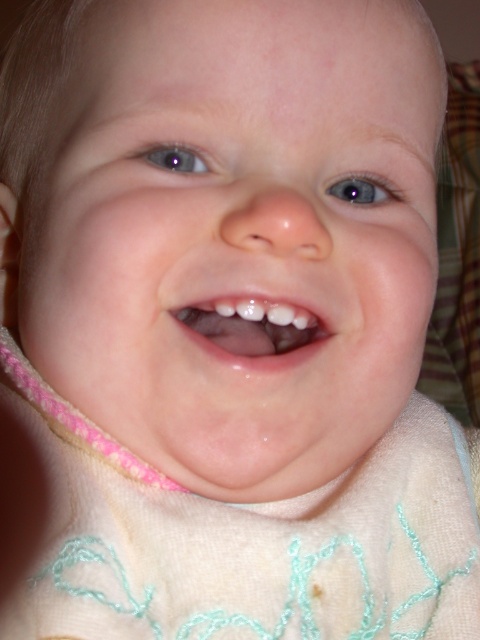
You are a photographer adjusting the lighting for a baby photo shoot. You want to ensure the white soft bib at center and white glossy teeth at center are both well lit. Since the bib is below the teeth, where should you position the light source to avoid shadows on the bib?

The white soft bib at center is below the white glossy teeth at center. To avoid shadows on the bib, position the light source below the bib so that the teeth do not cast a shadow over it.